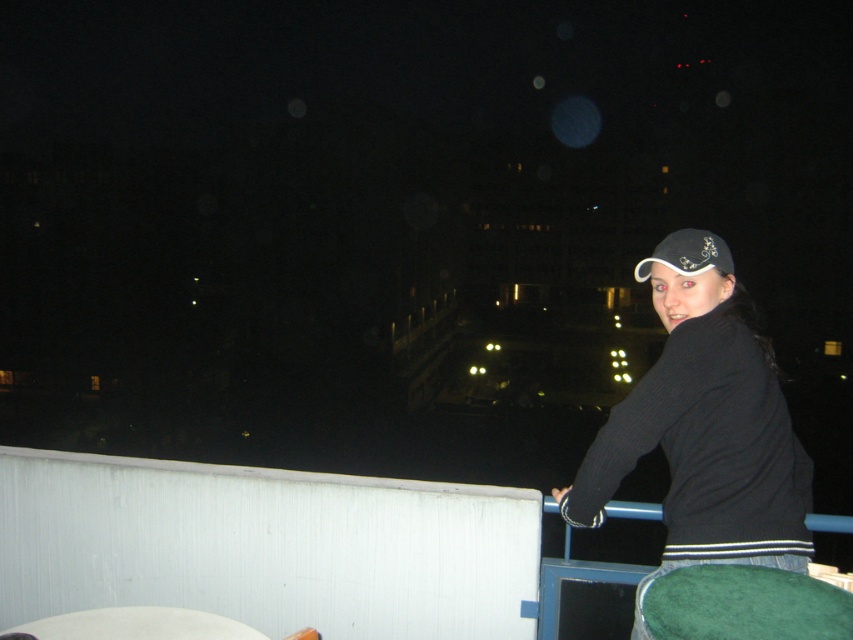
You are a fashion designer observing a model in a nighttime setting. The model is wearing a black ribbed sweater at upper right and a black fabric cap at upper right. Which clothing item is positioned lower on the model?

The black ribbed sweater at upper right is located below the black fabric cap at upper right, so the sweater is positioned lower on the model.

You are a fashion designer analyzing the outfit of the person in the image. The person is wearing a black ribbed sweater at upper right and a black fabric cap at upper right. Which item is closer to the camera?

The black ribbed sweater at upper right is in front of the black fabric cap at upper right, so the sweater is closer to the camera.

You are a fashion designer observing the nighttime scene. You need to determine which item of clothing is wider between the black ribbed sweater at upper right and the black fabric cap at upper right. Which one is wider?

The black fabric cap at upper right is wider than the black ribbed sweater at upper right according to the description.